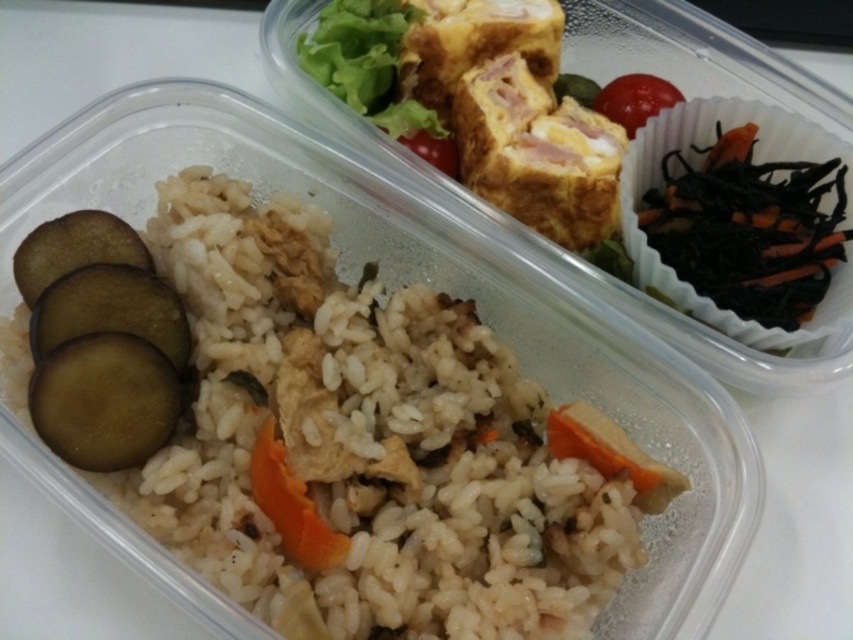
Question: Is black shredded seaweed at upper right thinner than red matte tomato at upper right?

Choices:
 (A) no
 (B) yes

Answer: (A)

Question: Does white matte rice at center have a greater width compared to orange matte carrot at center?

Choices:
 (A) yes
 (B) no

Answer: (A)

Question: Is white matte rice at center smaller than orange matte carrot at center?

Choices:
 (A) yes
 (B) no

Answer: (B)

Question: Among these objects, which one is nearest to the camera?

Choices:
 (A) black shredded seaweed at upper right
 (B) white matte rice at center
 (C) orange matte carrot at center
 (D) red matte tomato at upper right

Answer: (B)

Question: Which of the following is the closest to the observer?

Choices:
 (A) (598, 106)
 (B) (270, 465)
 (C) (776, 204)

Answer: (B)

Question: Which of the following is the farthest from the observer?

Choices:
 (A) (430, 353)
 (B) (682, 196)

Answer: (B)